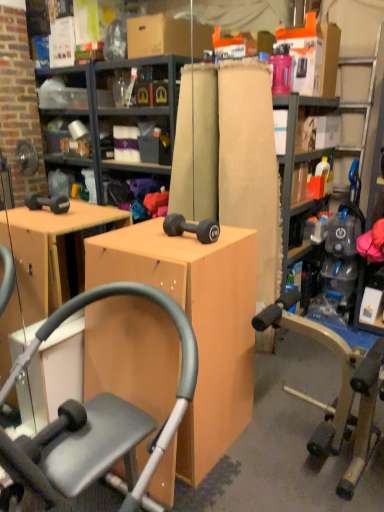
In order to face matte cardboard shelf at upper center, should I rotate leftwards or rightwards?

You should rotate right by 17.161 degrees.

In the scene shown: What is the approximate width of matte black dumbbell at center?

It is 9.39 inches.

Where is `wooden bookshelf at center`? The height and width of the screenshot is (512, 384). wooden bookshelf at center is located at coordinates (294, 156).

Between matte black dumbbell at center and matte black exercise machine at center, which one has smaller width?

Thinner between the two is matte black dumbbell at center.

Does matte black dumbbell at center have a smaller size compared to matte black exercise machine at center?

Yes.

Considering the relative positions of matte black dumbbell at center and matte black exercise machine at center in the image provided, is matte black dumbbell at center to the left or to the right of matte black exercise machine at center?

In the image, matte black dumbbell at center appears on the right side of matte black exercise machine at center.

In order to click on chair below the matte black dumbbell at center (from the image's perspective) in this screenshot , I will do `click(96, 417)`.

Is matte black exercise machine at center positioned with its back to matte black dumbbell at center?

No, matte black exercise machine at center is not facing the opposite direction of matte black dumbbell at center.

Do you think matte black exercise machine at center is within matte black dumbbell at center, or outside of it?

matte black exercise machine at center lies outside matte black dumbbell at center.

In the scene shown: Is matte black dumbbell at center at the right side of wooden bookshelf at center?

In fact, matte black dumbbell at center is to the left of wooden bookshelf at center.

Considering the points (206, 222) and (304, 101), which point is behind, point (206, 222) or point (304, 101)?

The point (304, 101) is farther.

Is matte black dumbbell at center in front of or behind wooden bookshelf at center in the image?

In the image, matte black dumbbell at center appears in front of wooden bookshelf at center.

Is matte black dumbbell at center far away from wooden bookshelf at center?

No, matte black dumbbell at center is not far from wooden bookshelf at center.

Is matte black dumbbell at center outside of matte cardboard shelf at upper center?

Yes, matte black dumbbell at center is not within matte cardboard shelf at upper center.

Is matte black dumbbell at center aimed at matte cardboard shelf at upper center?

No, matte black dumbbell at center is not facing towards matte cardboard shelf at upper center.

Considering the sizes of matte black dumbbell at center and matte cardboard shelf at upper center in the image, is matte black dumbbell at center bigger or smaller than matte cardboard shelf at upper center?

Considering their sizes, matte black dumbbell at center takes up less space than matte cardboard shelf at upper center.

Considering the relative positions of matte black dumbbell at center and matte cardboard shelf at upper center in the image provided, is matte black dumbbell at center to the left of matte cardboard shelf at upper center from the viewer's perspective?

Yes.

Between matte black exercise machine at center and matte wood desk at center, which one has less height?

matte wood desk at center.

Looking at this image, would you say matte black exercise machine at center is outside matte wood desk at center?

Yes, matte black exercise machine at center is not within matte wood desk at center.

Consider the image. Does matte black exercise machine at center have a larger size compared to matte wood desk at center?

Correct, matte black exercise machine at center is larger in size than matte wood desk at center.

Where is `desk lying on the left of matte cardboard shelf at upper center`? desk lying on the left of matte cardboard shelf at upper center is located at coordinates click(x=195, y=330).

Considering the positions of point (323, 128) and point (86, 366), is point (323, 128) closer or farther from the camera than point (86, 366)?

Clearly, point (323, 128) is more distant from the camera than point (86, 366).

Can you confirm if matte cardboard shelf at upper center is positioned to the right of matte wood desk at center?

Indeed, matte cardboard shelf at upper center is positioned on the right side of matte wood desk at center.

Between matte cardboard shelf at upper center and matte wood desk at center, which one has less height?

matte cardboard shelf at upper center is shorter.

Can you confirm if matte cardboard shelf at upper center is shorter than wooden bookshelf at center?

Correct, matte cardboard shelf at upper center is not as tall as wooden bookshelf at center.

Would you consider matte cardboard shelf at upper center to be distant from wooden bookshelf at center?

Actually, matte cardboard shelf at upper center and wooden bookshelf at center are a little close together.

Considering the positions of point (305, 132) and point (288, 221), is point (305, 132) closer or farther from the camera than point (288, 221)?

Point (305, 132) is positioned farther from the camera compared to point (288, 221).

The image size is (384, 512). I want to click on dumbbell behind the matte black exercise machine at center, so click(x=192, y=228).

Image resolution: width=384 pixels, height=512 pixels. What are the coordinates of `chair below the matte black dumbbell at center (from the image's perspective)` in the screenshot? It's located at (96, 417).

Looking at the image, which one is located closer to matte wood desk at center, matte black dumbbell at center or matte black exercise machine at center?

Among the two, matte black exercise machine at center is located nearer to matte wood desk at center.

From the picture: Considering their positions, is matte black dumbbell at center positioned further to wooden bookshelf at center than matte cardboard shelf at upper center?

Among the two, matte black dumbbell at center is located further to wooden bookshelf at center.

Looking at this image, from the image, which object appears to be farther from matte black dumbbell at center, matte wood desk at center or matte cardboard shelf at upper center?

matte cardboard shelf at upper center is positioned further to the anchor matte black dumbbell at center.

Based on their spatial positions, is matte black exercise machine at center or wooden bookshelf at center closer to matte black dumbbell at center?

matte black exercise machine at center is positioned closer to the anchor matte black dumbbell at center.

From the image, which object appears to be farther from matte cardboard shelf at upper center, matte black dumbbell at center or wooden bookshelf at center?

Based on the image, matte black dumbbell at center appears to be further to matte cardboard shelf at upper center.

From the image, which object appears to be farther from matte wood desk at center, wooden bookshelf at center or matte black dumbbell at center?

wooden bookshelf at center is further to matte wood desk at center.

From the picture: Estimate the real-world distances between objects in this image. Which object is further from wooden bookshelf at center, matte black dumbbell at center or matte black exercise machine at center?

Among the two, matte black exercise machine at center is located further to wooden bookshelf at center.

Based on their spatial positions, is matte cardboard shelf at upper center or matte black dumbbell at center further from wooden bookshelf at center?

The object further to wooden bookshelf at center is matte black dumbbell at center.

This screenshot has height=512, width=384. What are the coordinates of `desk between matte black exercise machine at center and wooden bookshelf at center along the z-axis` in the screenshot? It's located at (195, 330).

At what (x,y) coordinates should I click in order to perform the action: click on dumbbell between matte wood desk at center and matte cardboard shelf at upper center along the z-axis. Please return your answer as a coordinate pair (x, y). Looking at the image, I should click on (192, 228).

Locate an element on the screen. dumbbell between matte black exercise machine at center and matte cardboard shelf at upper center in the front-back direction is located at coordinates (192, 228).

Where is `bookshelf between matte wood desk at center and matte cardboard shelf at upper center along the z-axis`? This screenshot has height=512, width=384. bookshelf between matte wood desk at center and matte cardboard shelf at upper center along the z-axis is located at coordinates (294, 156).